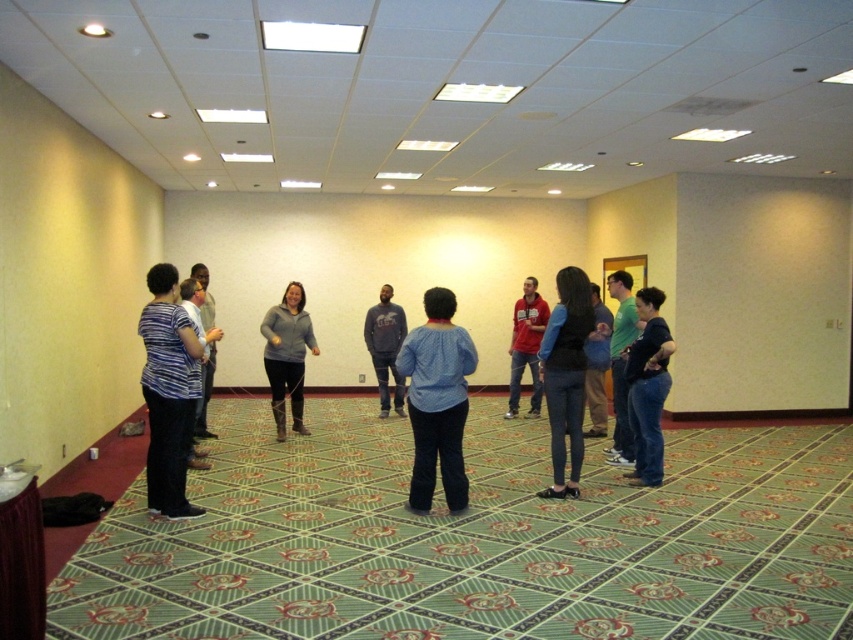
Is red cotton shirt at center wider than light gray sweater at center?

No.

Does red cotton shirt at center appear on the left side of light gray sweater at center?

No, red cotton shirt at center is not to the left of light gray sweater at center.

The height and width of the screenshot is (640, 853). I want to click on red cotton shirt at center, so click(x=526, y=346).

Which is in front, point (160, 483) or point (370, 358)?

Positioned in front is point (160, 483).

Can you confirm if striped fabric shirt at left is taller than gray sweater at center?

Yes, striped fabric shirt at left is taller than gray sweater at center.

Describe the element at coordinates (167, 392) in the screenshot. I see `striped fabric shirt at left` at that location.

The width and height of the screenshot is (853, 640). Find the location of `striped fabric shirt at left`. striped fabric shirt at left is located at coordinates (167, 392).

Is striped fabric shirt at left smaller than green cotton shirt at center?

Yes, striped fabric shirt at left is smaller than green cotton shirt at center.

Who is shorter, striped fabric shirt at left or green cotton shirt at center?

Standing shorter between the two is striped fabric shirt at left.

Is point (160, 348) farther from viewer compared to point (618, 371)?

No, (160, 348) is in front of (618, 371).

Locate an element on the screen. This screenshot has width=853, height=640. striped fabric shirt at left is located at coordinates (167, 392).